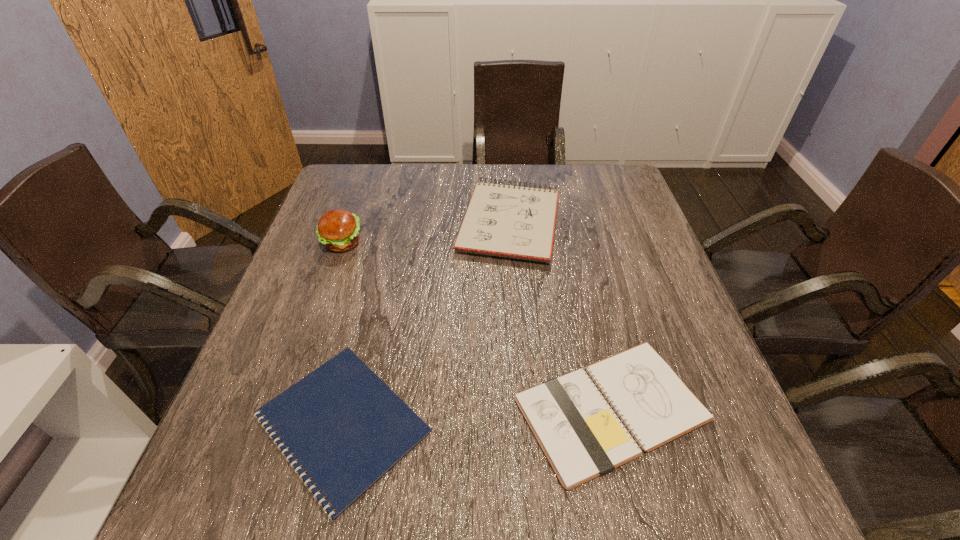
What are the coordinates of `free space at the far right corner of the desktop` in the screenshot? It's located at (599, 188).

Locate an element on the screen. The image size is (960, 540). vacant area that lies between the tallest object and the shortest object is located at coordinates (342, 333).

Find the location of a particular element. This screenshot has width=960, height=540. free point between the farthest notepad and the hamburger is located at coordinates (425, 233).

You are a GUI agent. You are given a task and a screenshot of the screen. Output one action in this format:
    pyautogui.click(x=<x>, y=<y>)
    Task: Click on the vacant area between the shortest notepad and the second tallest notepad
    The image size is (960, 540).
    Given the screenshot: What is the action you would take?
    pyautogui.click(x=476, y=416)

Locate an element on the screen. The width and height of the screenshot is (960, 540). empty space that is in between the second shortest notepad and the tallest notepad is located at coordinates (560, 316).

Image resolution: width=960 pixels, height=540 pixels. What are the coordinates of `free space between the third shortest object and the second shortest notepad` in the screenshot? It's located at (560, 316).

The height and width of the screenshot is (540, 960). I want to click on free area in between the second shortest object and the hamburger, so click(476, 326).

Image resolution: width=960 pixels, height=540 pixels. Find the location of `vacant space in between the tallest notepad and the tallest object`. vacant space in between the tallest notepad and the tallest object is located at coordinates pyautogui.click(x=425, y=233).

This screenshot has width=960, height=540. I want to click on free space between the second shortest notepad and the hamburger, so (476, 326).

At what (x,y) coordinates should I click in order to perform the action: click on free space between the shortest object and the tallest object. Please return your answer as a coordinate pair (x, y). Looking at the image, I should click on click(342, 333).